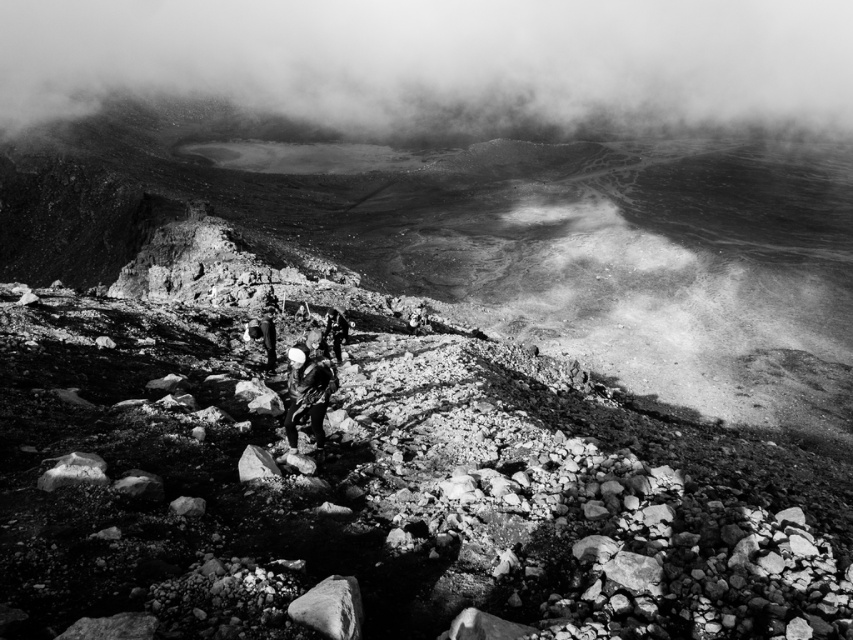
You are a geologist analyzing this landscape. You notice a point marked at coordinates (73, 472). Based on the image, what type of terrain feature is located at this point?

The point at (73, 472) is on a smooth gray rock at lower left.

You are a hiker looking for a safe path up the slope. You notice a smooth gray rock at lower left and a dark fabric jacket at center. Which object is positioned closer to the bottom of the slope?

The smooth gray rock at lower left is positioned closer to the bottom of the slope since it is located below the dark fabric jacket at center.